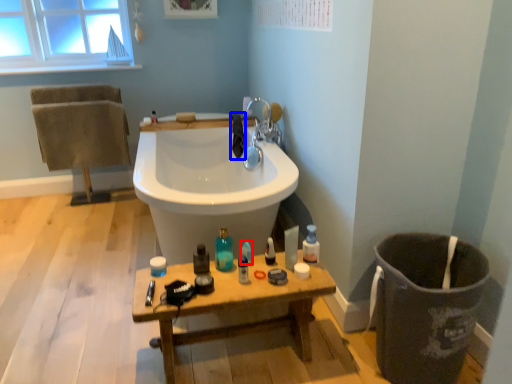
Question: Among these objects, which one is nearest to the camera, cleaning product (highlighted by a red box) or bath towel (highlighted by a blue box)?

Choices:
 (A) cleaning product
 (B) bath towel

Answer: (A)